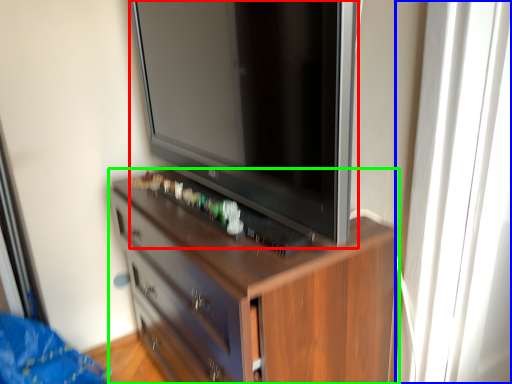
Question: Estimate the real-world distances between objects in this image. Which object is closer to television (highlighted by a red box), glass door (highlighted by a blue box) or chest of drawers (highlighted by a green box)?

Choices:
 (A) glass door
 (B) chest of drawers

Answer: (B)